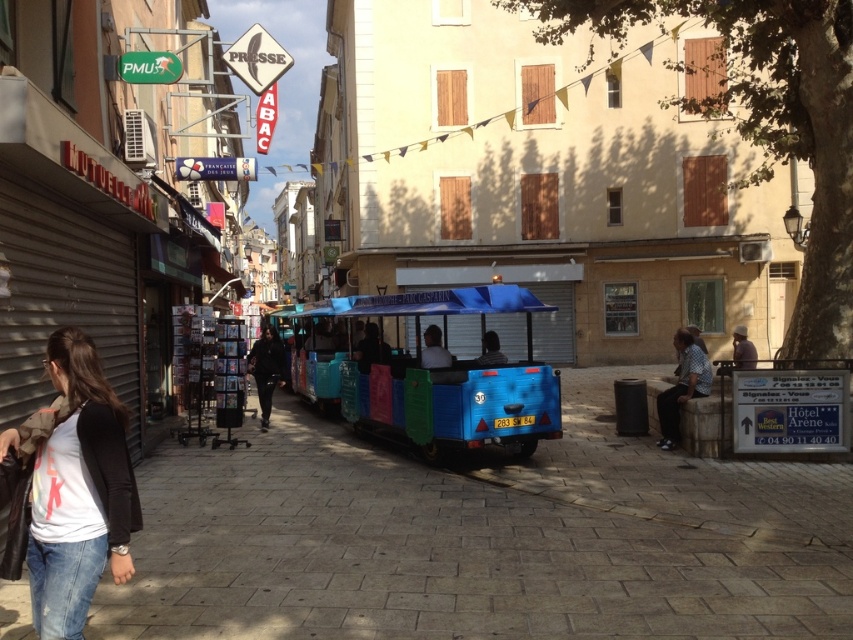
You are standing at the point labeled point (672,406) and want to walk to the point labeled point (387,509). Which direction should you move relative to your current position?

You should move forward because point (387,509) is in front of point (672,406).

You are a tourist standing on the smooth stone pavement at center and want to reach the denim at lower left. Which direction should you move to get there?

You should move towards the lower left direction to reach the denim at lower left from the smooth stone pavement at center.

You are a delivery person with a cart that is 12 feet long. You need to move from the smooth stone pavement at center to the patterned fabric shirt at center. Can your cart fit between them without going over either object?

The distance between the smooth stone pavement at center and the patterned fabric shirt at center is 13.67 feet, which is longer than your cart length of 12 feet. Therefore, your cart can fit between them without going over either object.